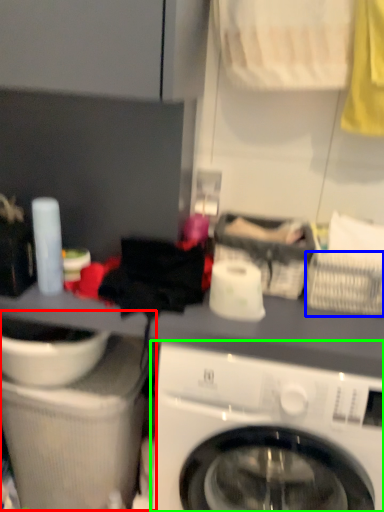
Question: Which object is positioned farthest from sink (highlighted by a red box)? Select from basket (highlighted by a blue box) and washing machine (highlighted by a green box).

Choices:
 (A) basket
 (B) washing machine

Answer: (A)